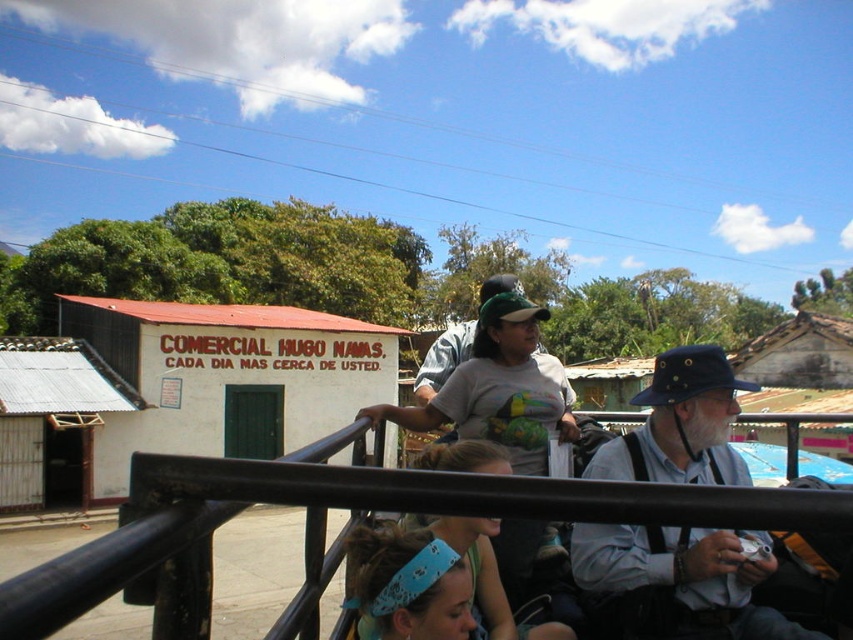
Describe the element at coordinates (680, 580) in the screenshot. I see `gray fabric hat at upper right` at that location.

Between gray fabric hat at upper right and gray cotton t-shirt at center, which one appears on the right side from the viewer's perspective?

gray fabric hat at upper right is more to the right.

At what (x,y) coordinates should I click in order to perform the action: click on gray fabric hat at upper right. Please return your answer as a coordinate pair (x, y). The image size is (853, 640). Looking at the image, I should click on (680, 580).

The image size is (853, 640). In order to click on gray fabric hat at upper right in this screenshot , I will do `click(680, 580)`.

Does black metal/rail at center have a smaller size compared to matte gray shirt at center?

Yes.

Can you confirm if black metal/rail at center is taller than matte gray shirt at center?

Incorrect, black metal/rail at center's height is not larger of matte gray shirt at center's.

What do you see at coordinates (323, 528) in the screenshot?
I see `black metal/rail at center` at bounding box center [323, 528].

Where is `black metal/rail at center`? The width and height of the screenshot is (853, 640). black metal/rail at center is located at coordinates (323, 528).

Does black metal/rail at center appear over gray fabric hat at upper right?

No.

Is black metal/rail at center positioned behind gray fabric hat at upper right?

No, it is not.

Who is more distant from viewer, (x=500, y=502) or (x=610, y=554)?

Positioned behind is point (x=610, y=554).

Image resolution: width=853 pixels, height=640 pixels. Identify the location of black metal/rail at center. (323, 528).